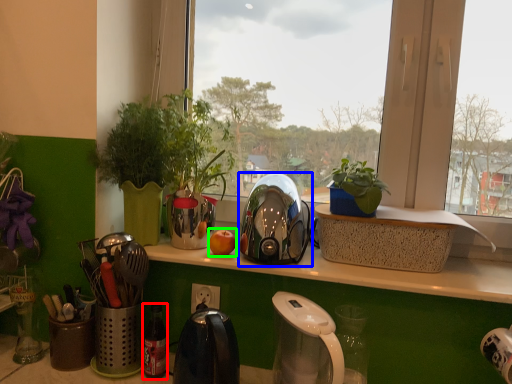
Question: Based on their relative distances, which object is nearer to bottle (highlighted by a red box)? Choose from kettle (highlighted by a blue box) and apple (highlighted by a green box).

Choices:
 (A) kettle
 (B) apple

Answer: (B)